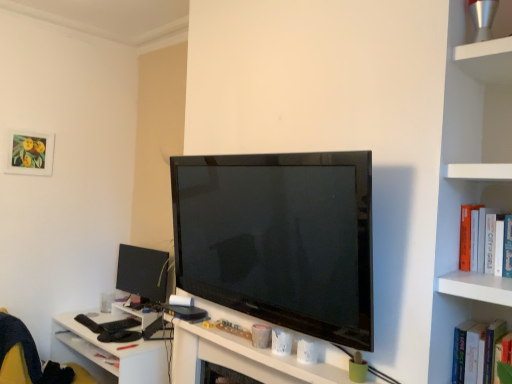
Find the location of a particular element. This screenshot has height=384, width=512. empty space that is ontop of white matte computer desk at center (from a real-world perspective) is located at coordinates (262, 339).